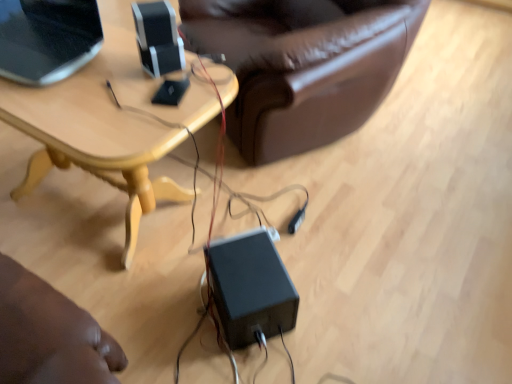
Question: Considering the relative positions of matte black laptop at upper left and black matte speaker at upper center, which is the 2th speaker from bottom to top, in the image provided, is matte black laptop at upper left behind black matte speaker at upper center, which is the 2th speaker from bottom to top,?

Choices:
 (A) yes
 (B) no

Answer: (B)

Question: Is there a large distance between matte black laptop at upper left and black matte speaker at upper center, marked as the 1th speaker in a top-to-bottom arrangement?

Choices:
 (A) no
 (B) yes

Answer: (A)

Question: Can you confirm if matte black laptop at upper left is thinner than black matte speaker at upper center, which is the 2th speaker from bottom to top?

Choices:
 (A) no
 (B) yes

Answer: (A)

Question: Is matte black laptop at upper left in front of black matte speaker at upper center, marked as the 1th speaker in a top-to-bottom arrangement?

Choices:
 (A) yes
 (B) no

Answer: (A)

Question: From the image's perspective, does matte black laptop at upper left appear lower than black matte speaker at upper center, marked as the 1th speaker in a top-to-bottom arrangement?

Choices:
 (A) yes
 (B) no

Answer: (B)

Question: Is matte black laptop at upper left surrounding black matte speaker at upper center, which is the 2th speaker from bottom to top?

Choices:
 (A) yes
 (B) no

Answer: (B)

Question: Is the position of matte black laptop at upper left less distant than that of black plastic power supply at center, the first speaker from the right?

Choices:
 (A) yes
 (B) no

Answer: (A)

Question: Is black plastic power supply at center, which ranks as the 2th speaker in top-to-bottom order, at the back of matte black laptop at upper left?

Choices:
 (A) no
 (B) yes

Answer: (A)

Question: From the image's perspective, is matte black laptop at upper left over black plastic power supply at center, which ranks as the 2th speaker in top-to-bottom order?

Choices:
 (A) no
 (B) yes

Answer: (B)

Question: Can you confirm if matte black laptop at upper left is thinner than black plastic power supply at center, the second speaker viewed from the left?

Choices:
 (A) no
 (B) yes

Answer: (A)

Question: From a real-world perspective, does matte black laptop at upper left stand above black plastic power supply at center, the second speaker viewed from the left?

Choices:
 (A) no
 (B) yes

Answer: (B)

Question: From a real-world perspective, does matte black laptop at upper left sit lower than black plastic power supply at center, the second speaker viewed from the left?

Choices:
 (A) no
 (B) yes

Answer: (A)

Question: Is black matte speaker at upper center, which is the 2th speaker from bottom to top, taller than matte black laptop at upper left?

Choices:
 (A) no
 (B) yes

Answer: (A)